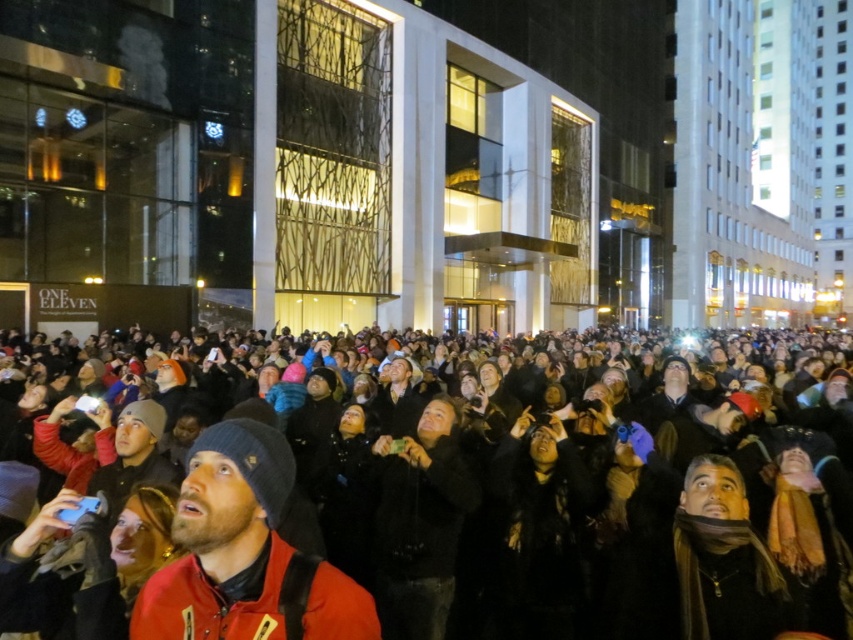
Is dark clothing crowd at center wider than red matte jacket at center?

Indeed, dark clothing crowd at center has a greater width compared to red matte jacket at center.

Is dark clothing crowd at center further to camera compared to red matte jacket at center?

Yes, it is.

What do you see at coordinates (477, 536) in the screenshot? The height and width of the screenshot is (640, 853). I see `dark clothing crowd at center` at bounding box center [477, 536].

At what (x,y) coordinates should I click in order to perform the action: click on dark clothing crowd at center. Please return your answer as a coordinate pair (x, y). Looking at the image, I should click on (477, 536).